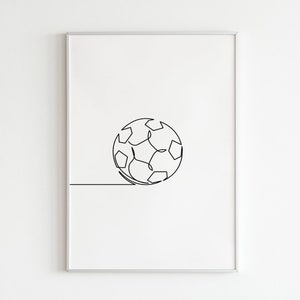
Identify the location of bottom of painting. (153, 268).